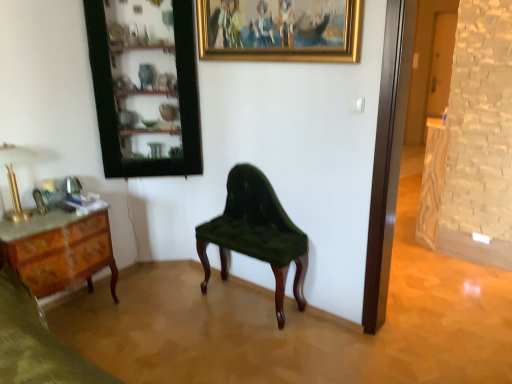
Question: From a real-world perspective, is gold polished metal lamp at left physically located above or below gold/golden frame at upper center?

Choices:
 (A) above
 (B) below

Answer: (B)

Question: From the image's perspective, is gold polished metal lamp at left above or below gold/golden frame at upper center?

Choices:
 (A) below
 (B) above

Answer: (A)

Question: Estimate the real-world distances between objects in this image. Which object is farther from the gold polished metal lamp at left?

Choices:
 (A) gold/golden frame at upper center
 (B) velvet green chair at center
 (C) marble top wood desk at left
 (D) wooden cabinet at upper left

Answer: (A)

Question: Which is nearer to the marble top wood desk at left?

Choices:
 (A) gold/golden frame at upper center
 (B) wooden cabinet at upper left
 (C) gold polished metal lamp at left
 (D) velvet green chair at center

Answer: (C)